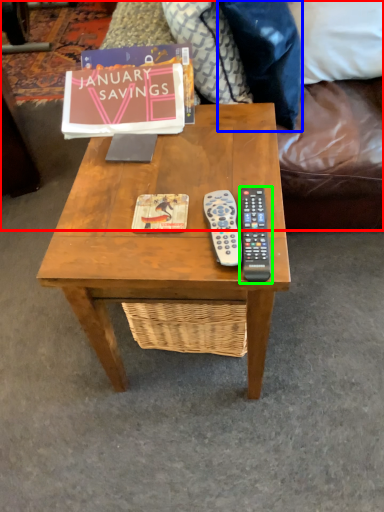
Question: Based on their relative distances, which object is nearer to studio couch (highlighted by a red box)? Choose from pillow (highlighted by a blue box) and remote control (highlighted by a green box).

Choices:
 (A) pillow
 (B) remote control

Answer: (A)